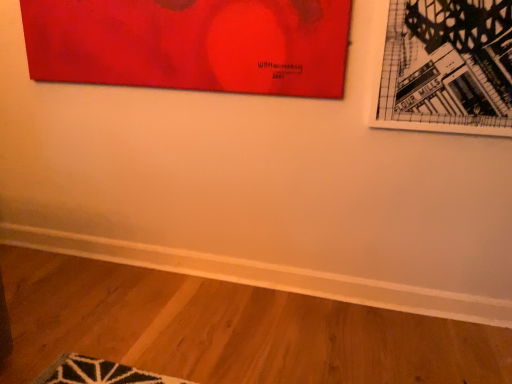
Question: Is black paper picture frame at upper right, which is the first picture frame from right to left, in front of or behind matte red painting at upper left, acting as the 2th picture frame starting from the right, in the image?

Choices:
 (A) behind
 (B) front

Answer: (B)

Question: Is black paper picture frame at upper right, which is the first picture frame from right to left, to the left or to the right of matte red painting at upper left, acting as the 2th picture frame starting from the right, in the image?

Choices:
 (A) left
 (B) right

Answer: (B)

Question: Is point (397, 77) closer or farther from the camera than point (143, 9)?

Choices:
 (A) farther
 (B) closer

Answer: (B)

Question: In terms of width, does matte red painting at upper left, acting as the 2th picture frame starting from the right, look wider or thinner when compared to black paper picture frame at upper right, the second picture frame positioned from the left?

Choices:
 (A) thin
 (B) wide

Answer: (B)

Question: Is matte red painting at upper left, acting as the 2th picture frame starting from the right, spatially inside black paper picture frame at upper right, the second picture frame positioned from the left, or outside of it?

Choices:
 (A) outside
 (B) inside

Answer: (A)

Question: Based on their sizes in the image, would you say matte red painting at upper left, the first picture frame in the left-to-right sequence, is bigger or smaller than black paper picture frame at upper right, the second picture frame positioned from the left?

Choices:
 (A) small
 (B) big

Answer: (B)

Question: In the image, is matte red painting at upper left, acting as the 2th picture frame starting from the right, on the left side or the right side of black paper picture frame at upper right, which is the first picture frame from right to left?

Choices:
 (A) right
 (B) left

Answer: (B)